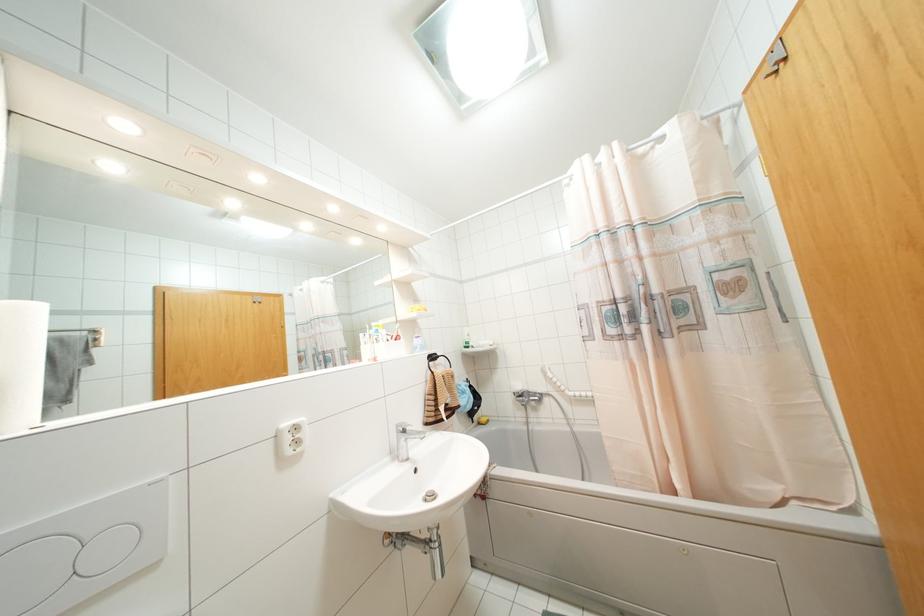
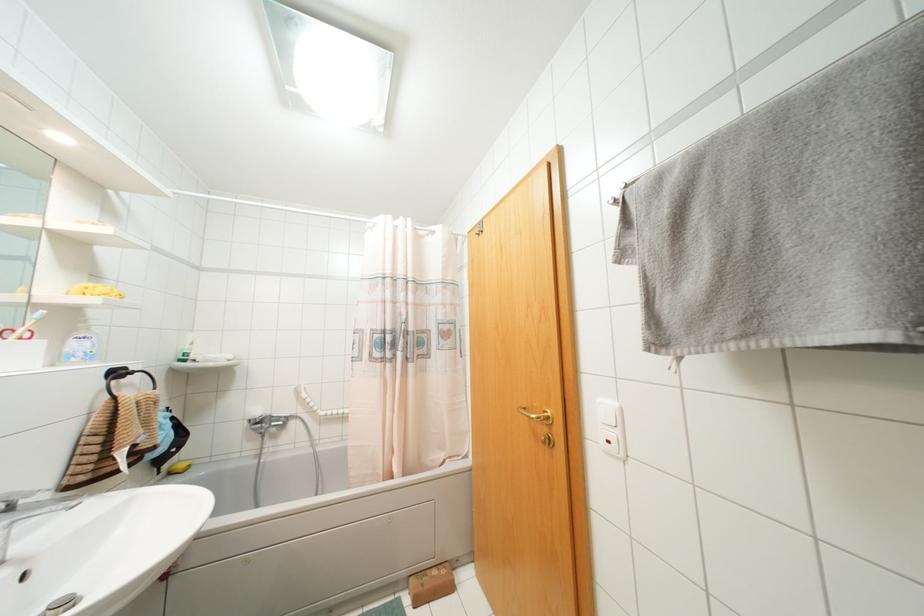
In the second image, find the point that corresponds to point 430,496 in the first image.

(66, 602)